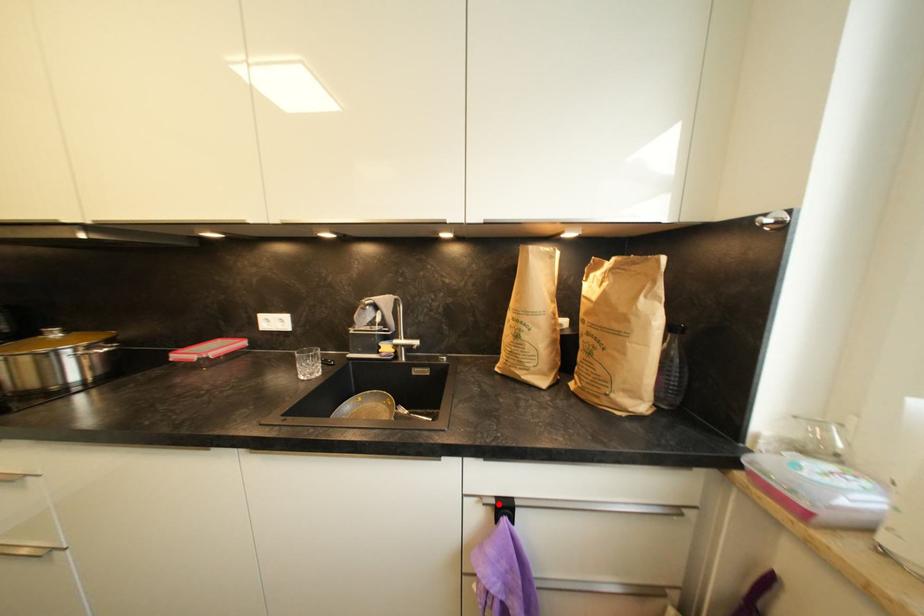
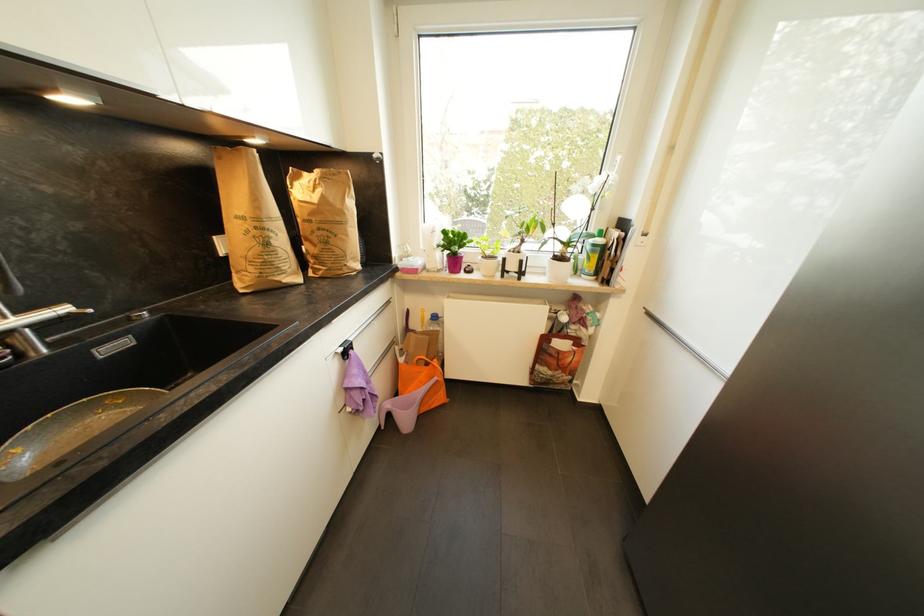
Question: I am providing you with two images of the same scene from different viewpoints. In image1, a red point is highlighted. Considering the same 3D point in image2, which of the following is correct?

Choices:
 (A) It is closer
 (B) It is farther

Answer: (A)